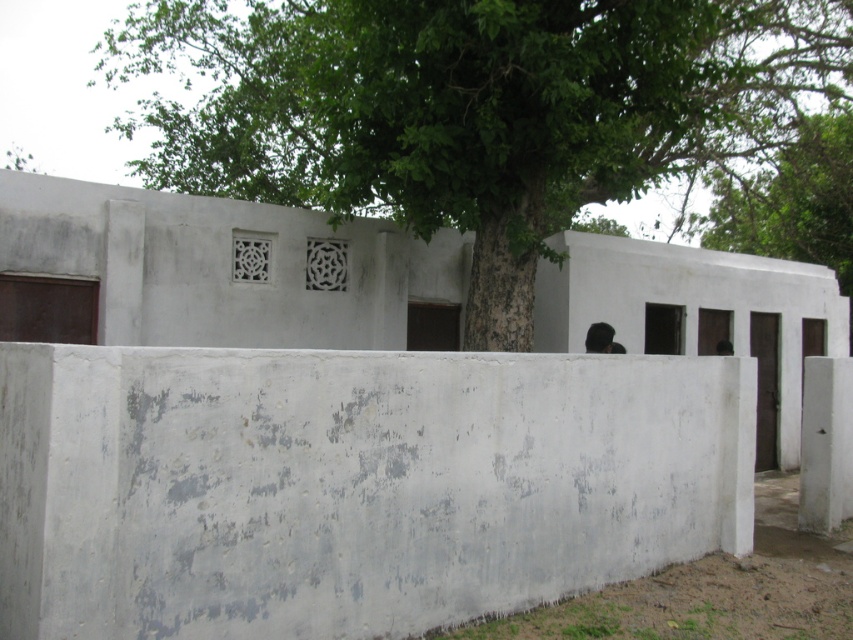
Does gray concrete wall at center have a greater width compared to green leafy tree at upper center?

Correct, the width of gray concrete wall at center exceeds that of green leafy tree at upper center.

Is point (323, 609) positioned in front of point (752, 202)?

Yes.

The height and width of the screenshot is (640, 853). What are the coordinates of `gray concrete wall at center` in the screenshot? It's located at (351, 484).

Is green rough bark tree at center to the right of green leafy tree at upper center from the viewer's perspective?

In fact, green rough bark tree at center is to the left of green leafy tree at upper center.

Identify the location of green rough bark tree at center. (474, 109).

I want to click on green rough bark tree at center, so click(474, 109).

At what (x,y) coordinates should I click in order to perform the action: click on green rough bark tree at center. Please return your answer as a coordinate pair (x, y). Looking at the image, I should click on (474, 109).

Is gray concrete wall at center above green rough bark tree at center?

No, gray concrete wall at center is not above green rough bark tree at center.

Does gray concrete wall at center lie behind green rough bark tree at center?

No, it is in front of green rough bark tree at center.

Is point (380, 630) closer to camera compared to point (450, 122)?

That is True.

Identify the location of gray concrete wall at center. (351, 484).